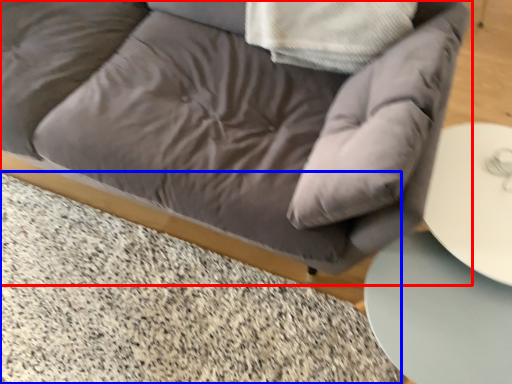
Question: Which object is closer to the camera taking this photo, studio couch (highlighted by a red box) or marble (highlighted by a blue box)?

Choices:
 (A) studio couch
 (B) marble

Answer: (A)